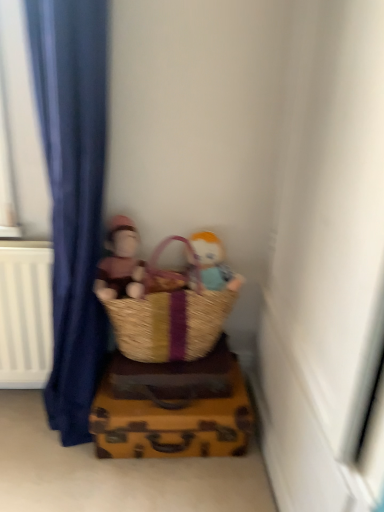
At what (x,y) coordinates should I click in order to perform the action: click on brown woven picnic basket at lower center. Please return your answer as a coordinate pair (x, y). The width and height of the screenshot is (384, 512). Looking at the image, I should click on point(139,321).

Describe the element at coordinates (171, 419) in the screenshot. I see `brown woven basket at lower center` at that location.

Locate an element on the screen. The width and height of the screenshot is (384, 512). soft plush toy at center, arranged as the first person when viewed from the left is located at coordinates (120, 263).

Which object is thinner, brown woven picnic basket at lower center or brown woven basket at lower center?

Thinner between the two is brown woven picnic basket at lower center.

In the scene shown: Is brown woven picnic basket at lower center positioned behind brown woven basket at lower center?

No, it is in front of brown woven basket at lower center.

From a real-world perspective, is brown woven picnic basket at lower center located higher than brown woven basket at lower center?

Correct, in the physical world, brown woven picnic basket at lower center is higher than brown woven basket at lower center.

In terms of height, does brown woven basket at lower center look taller or shorter compared to soft plush toy at center, the 2th person from the right?

In the image, brown woven basket at lower center appears to be shorter than soft plush toy at center, the 2th person from the right.

Is brown woven basket at lower center thinner than soft plush toy at center, arranged as the first person when viewed from the left?

No, brown woven basket at lower center is not thinner than soft plush toy at center, arranged as the first person when viewed from the left.

Does brown woven basket at lower center have a larger size compared to soft plush toy at center, arranged as the first person when viewed from the left?

Yes.

Looking at this image, can soft plush toy at center, arranged as the first person when viewed from the left, be found inside brown woven basket at lower center?

No, soft plush toy at center, arranged as the first person when viewed from the left, is not surrounded by brown woven basket at lower center.

Find the location of a particular element. The width and height of the screenshot is (384, 512). person lying in front of the matte plastic doll at center, arranged as the second person when viewed from the left is located at coordinates (x=120, y=263).

Is matte plastic doll at center, the first person viewed from the right, facing away from soft plush toy at center, the 2th person from the right?

No, matte plastic doll at center, the first person viewed from the right, is not facing the opposite direction of soft plush toy at center, the 2th person from the right.

Considering the relative sizes of matte plastic doll at center, arranged as the second person when viewed from the left, and soft plush toy at center, the 2th person from the right, in the image provided, is matte plastic doll at center, arranged as the second person when viewed from the left, thinner than soft plush toy at center, the 2th person from the right,?

Yes, matte plastic doll at center, arranged as the second person when viewed from the left, is thinner than soft plush toy at center, the 2th person from the right.

How different are the orientations of matte plastic doll at center, the first person viewed from the right, and soft plush toy at center, arranged as the first person when viewed from the left, in degrees?

There is a 0.00404-degree angle between the facing directions of matte plastic doll at center, the first person viewed from the right, and soft plush toy at center, arranged as the first person when viewed from the left.

The height and width of the screenshot is (512, 384). I want to click on picnic basket on the left of matte plastic doll at center, arranged as the second person when viewed from the left, so click(x=139, y=321).

Is matte plastic doll at center, the first person viewed from the right, not near brown woven picnic basket at lower center?

No.

Is matte plastic doll at center, the first person viewed from the right, aimed at brown woven picnic basket at lower center?

Yes, matte plastic doll at center, the first person viewed from the right, is oriented towards brown woven picnic basket at lower center.

Is matte plastic doll at center, the first person viewed from the right, not inside brown woven picnic basket at lower center?

No.

Is soft plush toy at center, arranged as the first person when viewed from the left, taller or shorter than brown woven picnic basket at lower center?

In the image, soft plush toy at center, arranged as the first person when viewed from the left, appears to be shorter than brown woven picnic basket at lower center.

Visually, is soft plush toy at center, arranged as the first person when viewed from the left, positioned to the left or to the right of brown woven picnic basket at lower center?

soft plush toy at center, arranged as the first person when viewed from the left, is to the left of brown woven picnic basket at lower center.

In order to click on picnic basket in front of the soft plush toy at center, the 2th person from the right in this screenshot , I will do `click(139, 321)`.

From the picture: Could you tell me if soft plush toy at center, arranged as the first person when viewed from the left, is facing brown woven picnic basket at lower center?

Yes.

Can you confirm if brown woven basket at lower center is thinner than matte plastic doll at center, the first person viewed from the right?

No.

Is brown woven basket at lower center turned away from matte plastic doll at center, the first person viewed from the right?

That's not correct — brown woven basket at lower center is not looking away from matte plastic doll at center, the first person viewed from the right.

There is a brown woven basket at lower center. In order to click on the 1st person above it (from the image's perspective) in this screenshot , I will do `click(214, 263)`.

Which is more distant, (162, 337) or (128, 230)?

Positioned behind is point (128, 230).

Is soft plush toy at center, the 2th person from the right, surrounded by brown woven picnic basket at lower center?

Yes, soft plush toy at center, the 2th person from the right, can be found within brown woven picnic basket at lower center.

Would you say brown woven picnic basket at lower center is a long distance from soft plush toy at center, the 2th person from the right?

No, brown woven picnic basket at lower center is not far from soft plush toy at center, the 2th person from the right.

Looking at this image, from a real-world perspective, is brown woven picnic basket at lower center positioned over soft plush toy at center, arranged as the first person when viewed from the left, based on gravity?

No, from a real-world perspective, brown woven picnic basket at lower center is not over soft plush toy at center, arranged as the first person when viewed from the left

Image resolution: width=384 pixels, height=512 pixels. I want to click on crate located on the left of brown woven picnic basket at lower center, so pos(171,419).

Image resolution: width=384 pixels, height=512 pixels. What are the coordinates of `crate on the right of the soft plush toy at center, arranged as the first person when viewed from the left` in the screenshot? It's located at (171, 419).

From the picture: Which object lies nearer to the anchor point brown woven basket at lower center, matte plastic doll at center, arranged as the second person when viewed from the left, or soft plush toy at center, arranged as the first person when viewed from the left?

Among the two, soft plush toy at center, arranged as the first person when viewed from the left, is located nearer to brown woven basket at lower center.

When comparing their distances from soft plush toy at center, the 2th person from the right, does matte plastic doll at center, the first person viewed from the right, or brown woven basket at lower center seem closer?

The object closer to soft plush toy at center, the 2th person from the right, is matte plastic doll at center, the first person viewed from the right.

When comparing their distances from soft plush toy at center, arranged as the first person when viewed from the left, does brown woven basket at lower center or matte plastic doll at center, the first person viewed from the right, seem closer?

matte plastic doll at center, the first person viewed from the right.

Estimate the real-world distances between objects in this image. Which object is closer to brown woven picnic basket at lower center, soft plush toy at center, arranged as the first person when viewed from the left, or matte plastic doll at center, arranged as the second person when viewed from the left?

soft plush toy at center, arranged as the first person when viewed from the left.

From the image, which object appears to be farther from brown woven picnic basket at lower center, brown woven basket at lower center or soft plush toy at center, the 2th person from the right?

Based on the image, brown woven basket at lower center appears to be further to brown woven picnic basket at lower center.

When comparing their distances from brown woven picnic basket at lower center, does matte plastic doll at center, arranged as the second person when viewed from the left, or brown woven basket at lower center seem closer?

matte plastic doll at center, arranged as the second person when viewed from the left.

Which object lies further to the anchor point matte plastic doll at center, arranged as the second person when viewed from the left, soft plush toy at center, the 2th person from the right, or brown woven picnic basket at lower center?

soft plush toy at center, the 2th person from the right, is positioned further to the anchor matte plastic doll at center, arranged as the second person when viewed from the left.

Estimate the real-world distances between objects in this image. Which object is further from brown woven picnic basket at lower center, soft plush toy at center, the 2th person from the right, or brown woven basket at lower center?

Among the two, brown woven basket at lower center is located further to brown woven picnic basket at lower center.

I want to click on picnic basket situated between soft plush toy at center, arranged as the first person when viewed from the left, and matte plastic doll at center, arranged as the second person when viewed from the left, from left to right, so click(x=139, y=321).

Locate an element on the screen. This screenshot has width=384, height=512. person between soft plush toy at center, the 2th person from the right, and brown woven basket at lower center in the up-down direction is located at coordinates (214, 263).

Find the location of a particular element. picnic basket between soft plush toy at center, arranged as the first person when viewed from the left, and brown woven basket at lower center from top to bottom is located at coordinates (139, 321).

Where is `picnic basket between matte plastic doll at center, arranged as the second person when viewed from the left, and brown woven basket at lower center in the up-down direction`? Image resolution: width=384 pixels, height=512 pixels. picnic basket between matte plastic doll at center, arranged as the second person when viewed from the left, and brown woven basket at lower center in the up-down direction is located at coordinates (139, 321).